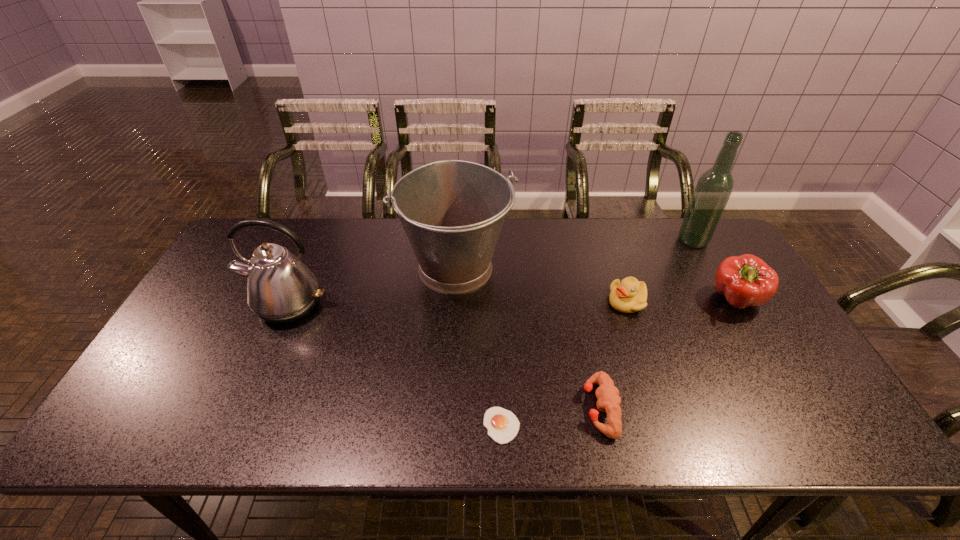
Find the location of a particular element. The height and width of the screenshot is (540, 960). liquor located in the far edge section of the desktop is located at coordinates (714, 187).

Locate an element on the screen. The height and width of the screenshot is (540, 960). bucket located at the far edge is located at coordinates click(452, 211).

Locate an element on the screen. The image size is (960, 540). puncher that is positioned at the near edge is located at coordinates (607, 394).

Locate an element on the screen. This screenshot has height=540, width=960. egg yolk that is positioned at the near edge is located at coordinates (503, 426).

You are a GUI agent. You are given a task and a screenshot of the screen. Output one action in this format:
    pyautogui.click(x=<x>, y=<y>)
    Task: Click on the object located at the left edge
    
    Given the screenshot: What is the action you would take?
    pyautogui.click(x=281, y=289)

The width and height of the screenshot is (960, 540). Identify the location of liquor present at the right edge. (714, 187).

You are a GUI agent. You are given a task and a screenshot of the screen. Output one action in this format:
    pyautogui.click(x=<x>, y=<y>)
    Task: Click on the pepper at the right edge
    This screenshot has height=540, width=960.
    Given the screenshot: What is the action you would take?
    pyautogui.click(x=746, y=280)

Identify the location of object located in the far right corner section of the desktop. (714, 187).

The height and width of the screenshot is (540, 960). Identify the location of vacant space at the far edge of the desktop. 359,235.

The height and width of the screenshot is (540, 960). Identify the location of free space at the near edge of the desktop. (599, 442).